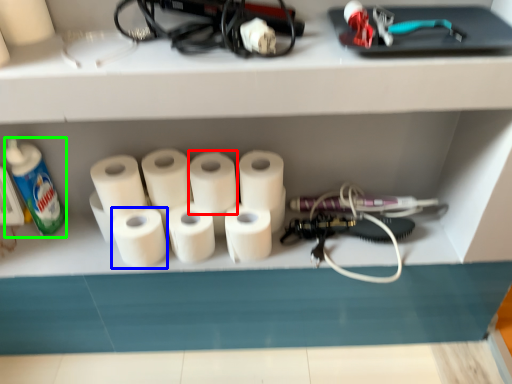
Question: Based on their relative distances, which object is nearer to toilet paper (highlighted by a red box)? Choose from toilet paper (highlighted by a blue box) and bottle (highlighted by a green box).

Choices:
 (A) toilet paper
 (B) bottle

Answer: (A)